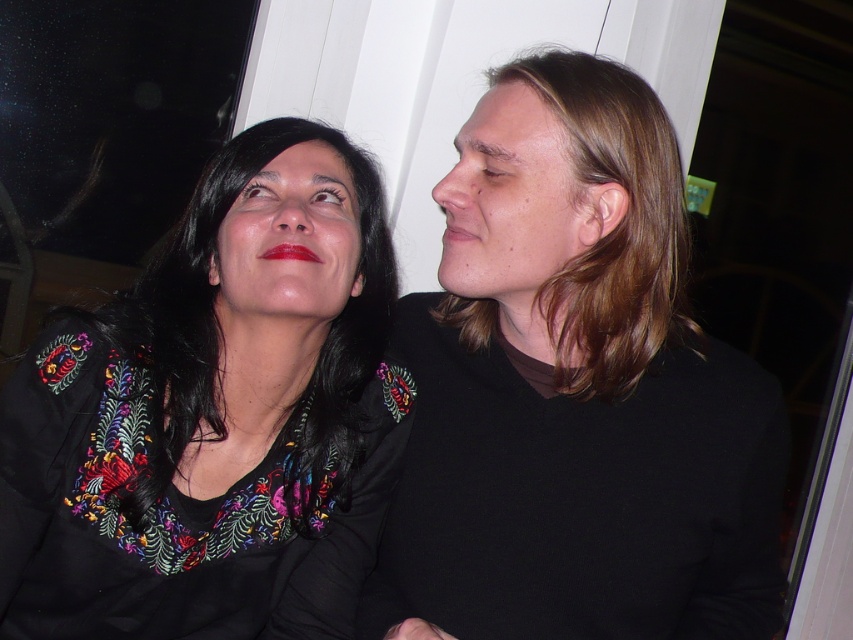
You are standing in a room with two people sitting near a white frame. You notice the black embroidered shirt at upper right and the blonde hair at upper right. Which object is positioned to the left of the other?

The black embroidered shirt at upper right is to the left of blonde hair at upper right.

You are standing in front of the image and want to know the position of the embroidered fabric blouse at upper left relative to the other person. Can you tell me where it is?

The embroidered fabric blouse at upper left is located at point (213, 416).

You are an artist trying to sketch this scene. You want to ensure that the black embroidered shirt at upper right and the blonde hair at upper right are proportionally accurate. Which object should you draw first to maintain proper proportions?

You should draw the black embroidered shirt at upper right first because it is larger than the blonde hair at upper right, so starting with the larger object ensures proper scaling for the smaller one.